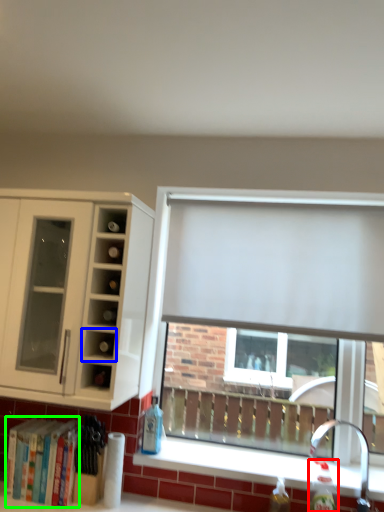
Question: Based on their relative distances, which object is nearer to bottle (highlighted by a red box)? Choose from cabinet (highlighted by a blue box) and bookshelf (highlighted by a green box).

Choices:
 (A) cabinet
 (B) bookshelf

Answer: (A)